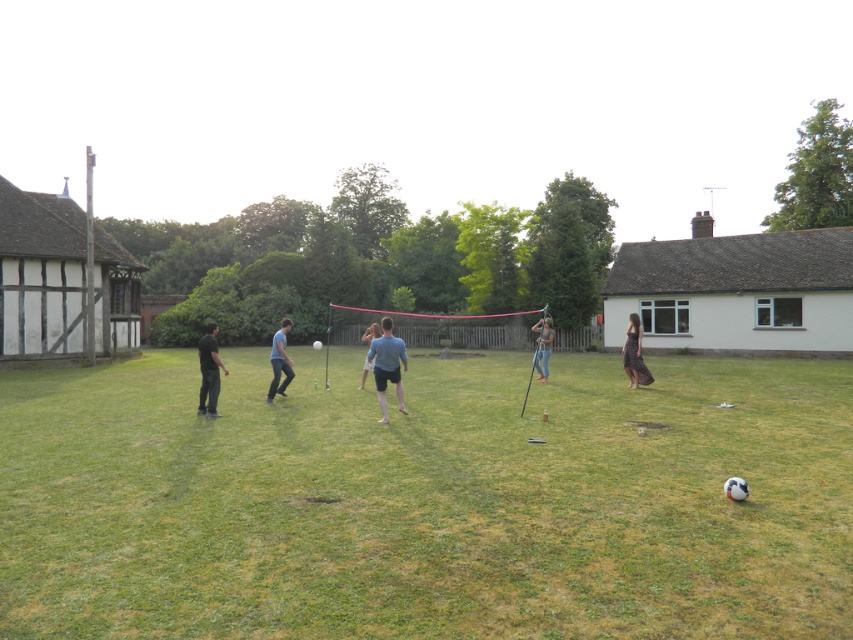
You are a fashion designer attending a garden party in this backyard. You brought both the black lace dress at right and the denim jeans at center. Since you want to wear the skinnier item, which one should you choose?

The black lace dress at right is thinner than the denim jeans at center, so you should choose the black lace dress at right as it is skinnier.

You are standing at the point marked as point (427, 500) in the image. Looking around, you see a traditional building on the left and a wooden fence in the background. What is directly under your feet?

The point (427, 500) is on green grass at center, so the ground directly under your feet is green grass at center.

You are a photographer trying to capture both the light blue shirt at center and the black matte shirt at left in a single shot. Which shirt will appear closer to the camera in the photo?

The light blue shirt at center will appear closer to the camera because it is positioned in front of the black matte shirt at left.